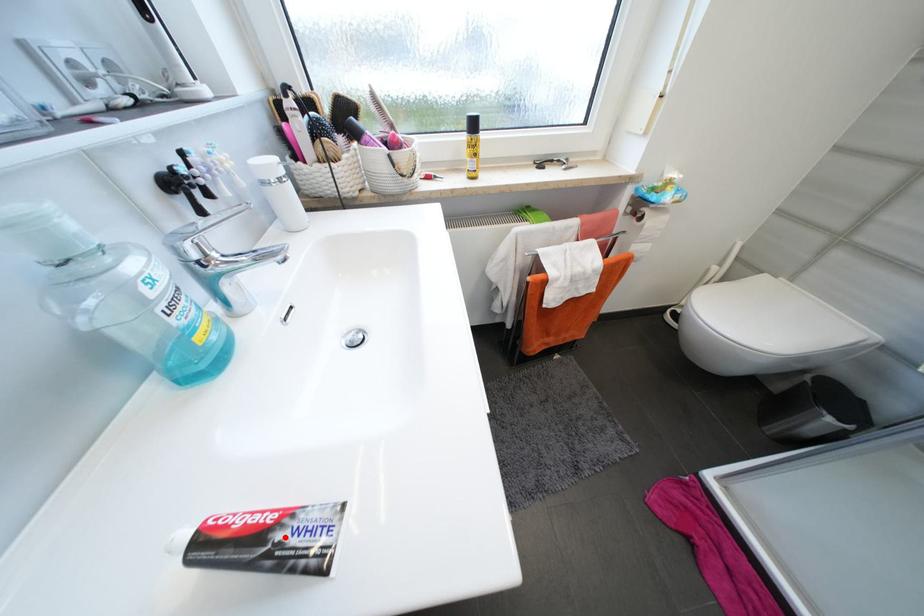
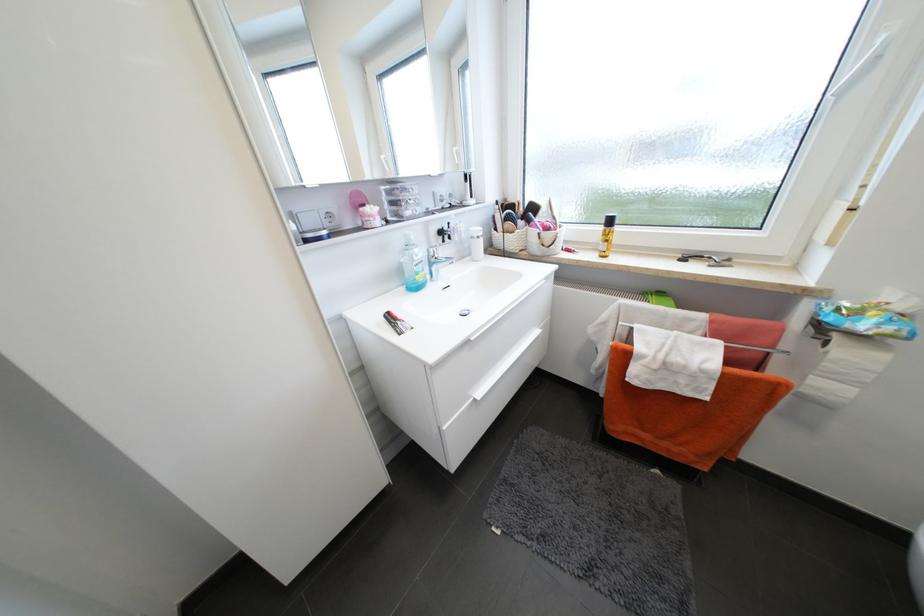
The point at the highlighted location is marked in the first image. Where is the corresponding point in the second image?

(405, 323)